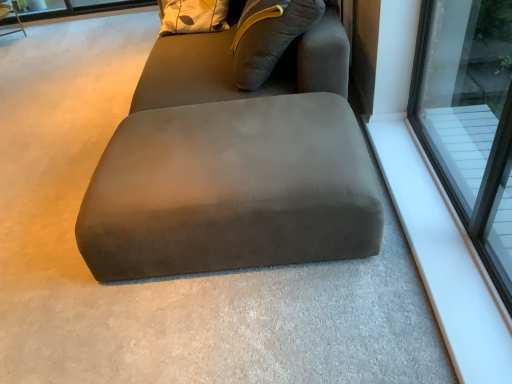
You are a GUI agent. You are given a task and a screenshot of the screen. Output one action in this format:
    pyautogui.click(x=<x>, y=<y>)
    Task: Click on the vacant space in front of suede ottoman at center
    The width and height of the screenshot is (512, 384).
    Given the screenshot: What is the action you would take?
    pyautogui.click(x=253, y=322)